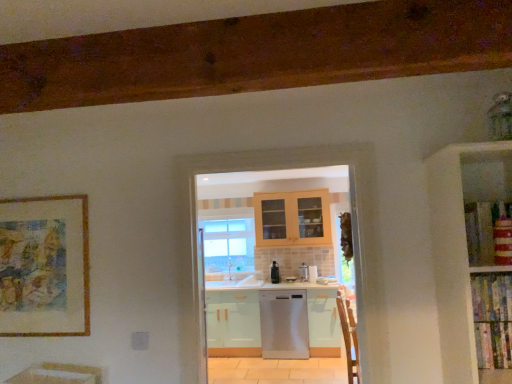
Question: From a real-world perspective, is satin black dishwasher at center located higher than satin silver dishwasher at center?

Choices:
 (A) no
 (B) yes

Answer: (B)

Question: From the image's perspective, would you say satin black dishwasher at center is positioned over satin silver dishwasher at center?

Choices:
 (A) no
 (B) yes

Answer: (B)

Question: From the image's perspective, is satin black dishwasher at center beneath satin silver dishwasher at center?

Choices:
 (A) no
 (B) yes

Answer: (A)

Question: Is the surface of satin black dishwasher at center in direct contact with satin silver dishwasher at center?

Choices:
 (A) no
 (B) yes

Answer: (A)

Question: Is satin black dishwasher at center looking in the opposite direction of satin silver dishwasher at center?

Choices:
 (A) yes
 (B) no

Answer: (B)

Question: Looking at their shapes, would you say satin black dishwasher at center is wider or thinner than satin silver dishwasher at center?

Choices:
 (A) wide
 (B) thin

Answer: (A)

Question: In the image, is satin black dishwasher at center positioned in front of or behind satin silver dishwasher at center?

Choices:
 (A) front
 (B) behind

Answer: (B)

Question: Is satin black dishwasher at center taller or shorter than satin silver dishwasher at center?

Choices:
 (A) tall
 (B) short

Answer: (A)

Question: In terms of size, does satin black dishwasher at center appear bigger or smaller than satin silver dishwasher at center?

Choices:
 (A) small
 (B) big

Answer: (B)

Question: Is clear glass window at center spatially inside satin silver dishwasher at center, or outside of it?

Choices:
 (A) inside
 (B) outside

Answer: (B)

Question: Looking at the image, does clear glass window at center seem bigger or smaller compared to satin silver dishwasher at center?

Choices:
 (A) big
 (B) small

Answer: (A)

Question: Is clear glass window at center to the left or to the right of satin silver dishwasher at center in the image?

Choices:
 (A) right
 (B) left

Answer: (B)

Question: Is clear glass window at center in front of or behind satin silver dishwasher at center in the image?

Choices:
 (A) front
 (B) behind

Answer: (B)

Question: Based on their positions, is clear glass window at center located to the left or right of satin silver dishwasher at center?

Choices:
 (A) left
 (B) right

Answer: (A)

Question: Is clear glass window at center inside the boundaries of satin silver dishwasher at center, or outside?

Choices:
 (A) inside
 (B) outside

Answer: (B)